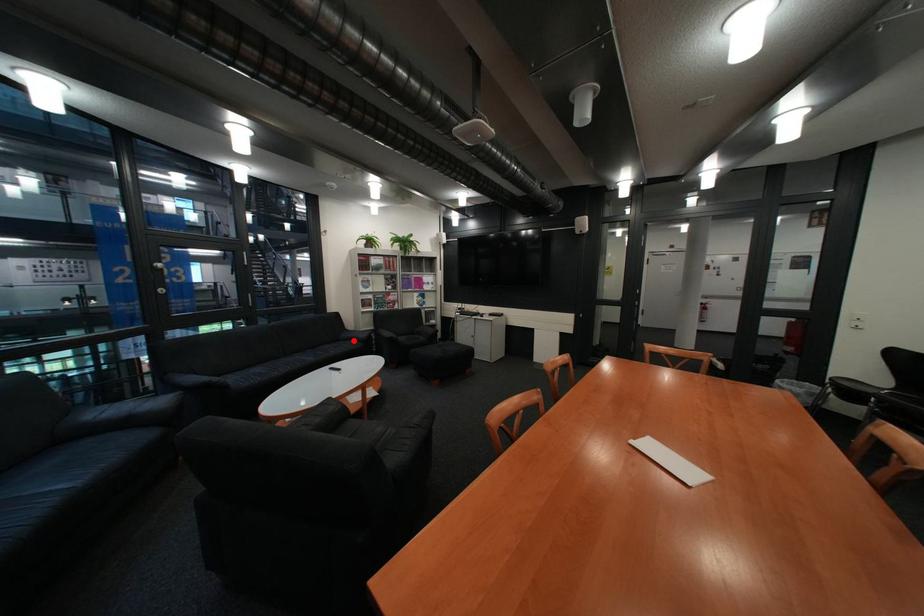
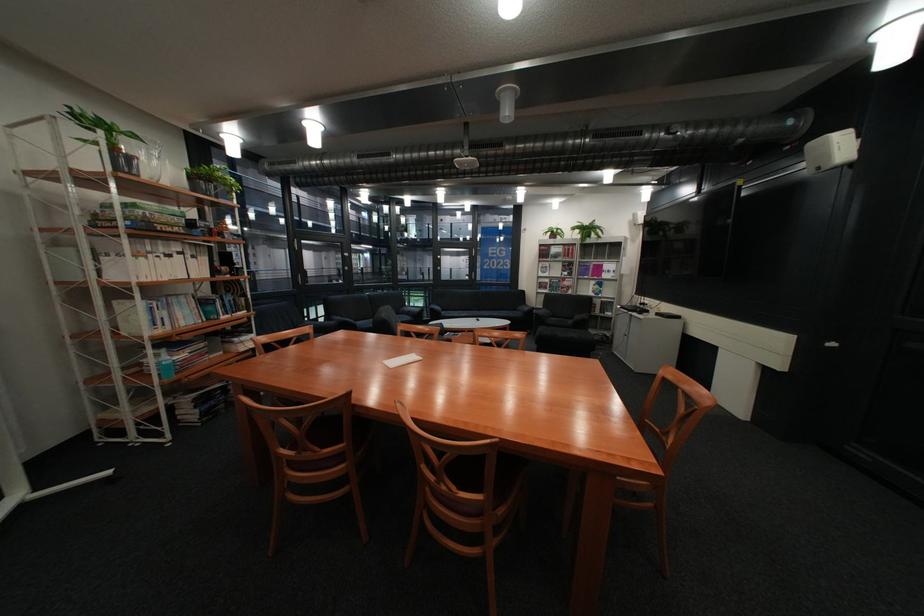
The point at the highlighted location is marked in the first image. Where is the corresponding point in the second image?

(531, 310)